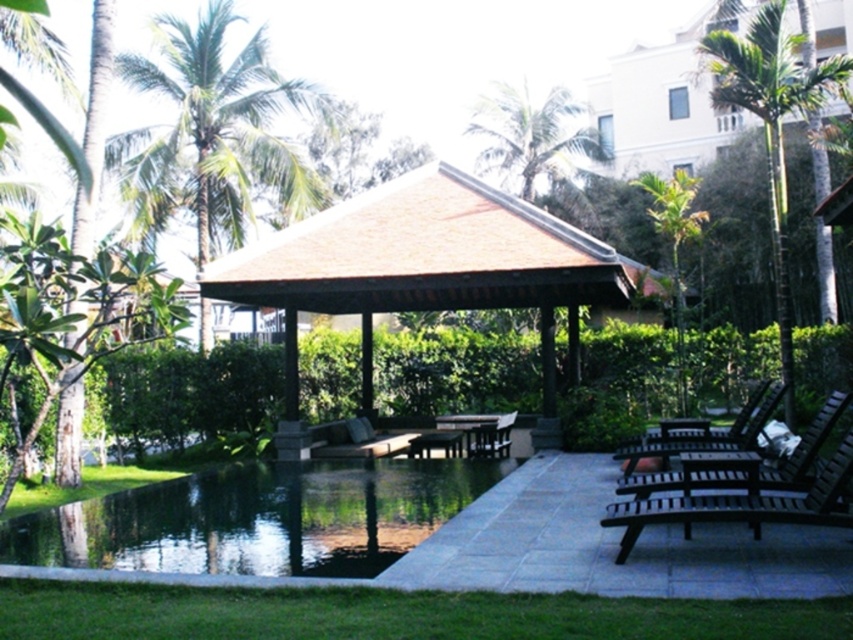
Question: Which of the following is the closest to the observer?

Choices:
 (A) wooden lounge chair at center
 (B) dark brown wooden lounge chair at lower right

Answer: (B)

Question: Can you confirm if green leafy palm tree at upper left is wider than dark brown wooden lounge chair at lower right?

Choices:
 (A) no
 (B) yes

Answer: (A)

Question: Estimate the real-world distances between objects in this image. Which object is closer to the dark brown wooden lounge chair at lower right?

Choices:
 (A) green leafy palm tree at upper right
 (B) green leafy palm tree at upper left

Answer: (A)

Question: Among these objects, which one is nearest to the camera?

Choices:
 (A) green concrete pond at lower left
 (B) wooden lounge chair at center

Answer: (A)

Question: Does green leafy palm tree at upper left appear on the right side of brown wooden chair at center?

Choices:
 (A) yes
 (B) no

Answer: (B)

Question: Can you confirm if brown wooden gazebo at center is wider than wooden lounge chair at center?

Choices:
 (A) yes
 (B) no

Answer: (B)